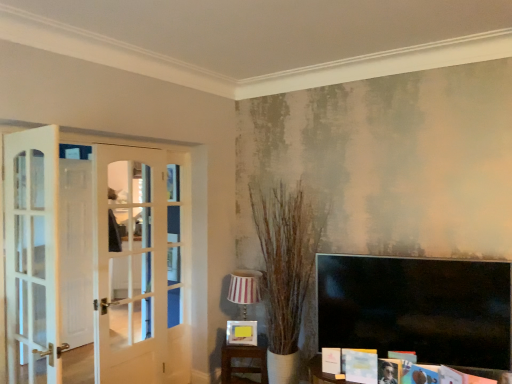
Describe the element at coordinates (244, 289) in the screenshot. I see `striped fabric lampshade at center` at that location.

Locate an element on the screen. The height and width of the screenshot is (384, 512). wooden table at lower center is located at coordinates (242, 367).

Where is `lamp on the left of the matte white magazine at lower right`? Image resolution: width=512 pixels, height=384 pixels. lamp on the left of the matte white magazine at lower right is located at coordinates (244, 289).

Is striped fabric lampshade at center to the left of matte white magazine at lower right from the viewer's perspective?

Correct, you'll find striped fabric lampshade at center to the left of matte white magazine at lower right.

Does point (229, 293) appear closer or farther from the camera than point (366, 364)?

Point (229, 293).

Does point (355, 377) come behind point (226, 367)?

No, it is not.

Is matte white magazine at lower right wider or thinner than wooden table at lower center?

Clearly, matte white magazine at lower right has less width compared to wooden table at lower center.

Between matte white magazine at lower right and wooden table at lower center, which one has larger size?

wooden table at lower center.

Is matte white magazine at lower right looking in the opposite direction of wooden table at lower center?

No, matte white magazine at lower right is not facing away from wooden table at lower center.

Does matte white magazine at lower right touch matte yellow picture frame at center?

No, matte white magazine at lower right is not touching matte yellow picture frame at center.

Is matte white magazine at lower right inside or outside of matte yellow picture frame at center?

matte white magazine at lower right is outside matte yellow picture frame at center.

Does matte white magazine at lower right turn towards matte yellow picture frame at center?

No.

From the image's perspective, who appears lower, matte white magazine at lower right or striped fabric lampshade at center?

From the image's view, matte white magazine at lower right is below.

Is matte white magazine at lower right bigger than striped fabric lampshade at center?

Actually, matte white magazine at lower right might be smaller than striped fabric lampshade at center.

In the image, is matte white magazine at lower right positioned in front of or behind striped fabric lampshade at center?

matte white magazine at lower right is in front of striped fabric lampshade at center.

From a real-world perspective, between matte white magazine at lower right and striped fabric lampshade at center, who is vertically higher?

From a 3D spatial view, striped fabric lampshade at center is above.

Can you confirm if matte yellow picture frame at center is bigger than matte white magazine at lower right?

Indeed, matte yellow picture frame at center has a larger size compared to matte white magazine at lower right.

From a real-world perspective, is matte yellow picture frame at center below matte white magazine at lower right?

Yes, from a real-world perspective, matte yellow picture frame at center is beneath matte white magazine at lower right.

Considering the positions of objects matte yellow picture frame at center and matte white magazine at lower right in the image provided, who is more to the right, matte yellow picture frame at center or matte white magazine at lower right?

From the viewer's perspective, matte white magazine at lower right appears more on the right side.

How many degrees apart are the facing directions of matte yellow picture frame at center and matte white magazine at lower right?

17.8 degrees.

Would you say wooden table at lower center is a long distance from striped fabric lampshade at center?

No, wooden table at lower center is not far away from striped fabric lampshade at center.

Considering the relative sizes of wooden table at lower center and striped fabric lampshade at center in the image provided, is wooden table at lower center bigger than striped fabric lampshade at center?

No, wooden table at lower center is not bigger than striped fabric lampshade at center.

Considering the sizes of objects wooden table at lower center and striped fabric lampshade at center in the image provided, who is shorter, wooden table at lower center or striped fabric lampshade at center?

Standing shorter between the two is wooden table at lower center.

Could you tell me if wooden table at lower center is facing striped fabric lampshade at center?

No, wooden table at lower center is not oriented towards striped fabric lampshade at center.

Which of these two, matte yellow picture frame at center or striped fabric lampshade at center, is smaller?

matte yellow picture frame at center.

Based on the photo, would you say matte yellow picture frame at center is outside striped fabric lampshade at center?

No, most part of matte yellow picture frame at center lies within striped fabric lampshade at center.

Consider the image. Which is more to the right, matte yellow picture frame at center or striped fabric lampshade at center?

striped fabric lampshade at center.

From the image's perspective, is matte yellow picture frame at center positioned above or below striped fabric lampshade at center?

Based on their image positions, matte yellow picture frame at center is located beneath striped fabric lampshade at center.

Locate an element on the screen. Image resolution: width=512 pixels, height=384 pixels. magazine lying in front of the striped fabric lampshade at center is located at coordinates (361, 365).

You are a GUI agent. You are given a task and a screenshot of the screen. Output one action in this format:
    pyautogui.click(x=<x>, y=<y>)
    Task: Click on the furniture on the left of matte white magazine at lower right
    Image resolution: width=512 pixels, height=384 pixels.
    Given the screenshot: What is the action you would take?
    pyautogui.click(x=242, y=367)

When comparing their distances from wooden table at lower center, does matte yellow picture frame at center or striped fabric lampshade at center seem further?

The object further to wooden table at lower center is striped fabric lampshade at center.

When comparing their distances from striped fabric lampshade at center, does matte white magazine at lower right or wooden table at lower center seem closer?

wooden table at lower center is closer to striped fabric lampshade at center.

Based on the photo, from the image, which object appears to be nearer to matte white magazine at lower right, wooden table at lower center or striped fabric lampshade at center?

Among the two, striped fabric lampshade at center is located nearer to matte white magazine at lower right.

Looking at the image, which one is located further to matte white magazine at lower right, striped fabric lampshade at center or wooden table at lower center?

The object further to matte white magazine at lower right is wooden table at lower center.

In the scene shown: Based on their spatial positions, is matte yellow picture frame at center or striped fabric lampshade at center further from matte white magazine at lower right?

striped fabric lampshade at center lies further to matte white magazine at lower right than the other object.

From the image, which object appears to be nearer to wooden table at lower center, matte white magazine at lower right or striped fabric lampshade at center?

striped fabric lampshade at center lies closer to wooden table at lower center than the other object.

Based on the photo, which object lies further to the anchor point matte yellow picture frame at center, striped fabric lampshade at center or wooden table at lower center?

The object further to matte yellow picture frame at center is striped fabric lampshade at center.

Looking at the image, which one is located further to striped fabric lampshade at center, wooden table at lower center or matte yellow picture frame at center?

wooden table at lower center is further to striped fabric lampshade at center.

Locate an element on the screen. picture frame located between matte white magazine at lower right and striped fabric lampshade at center in the depth direction is located at coordinates (241, 333).

Image resolution: width=512 pixels, height=384 pixels. What are the coordinates of `furniture between matte white magazine at lower right and matte yellow picture frame at center along the z-axis` in the screenshot? It's located at (242, 367).

Identify the location of picture frame between striped fabric lampshade at center and wooden table at lower center from top to bottom. (241, 333).

Locate an element on the screen. Image resolution: width=512 pixels, height=384 pixels. furniture between matte white magazine at lower right and striped fabric lampshade at center in the front-back direction is located at coordinates (x=242, y=367).